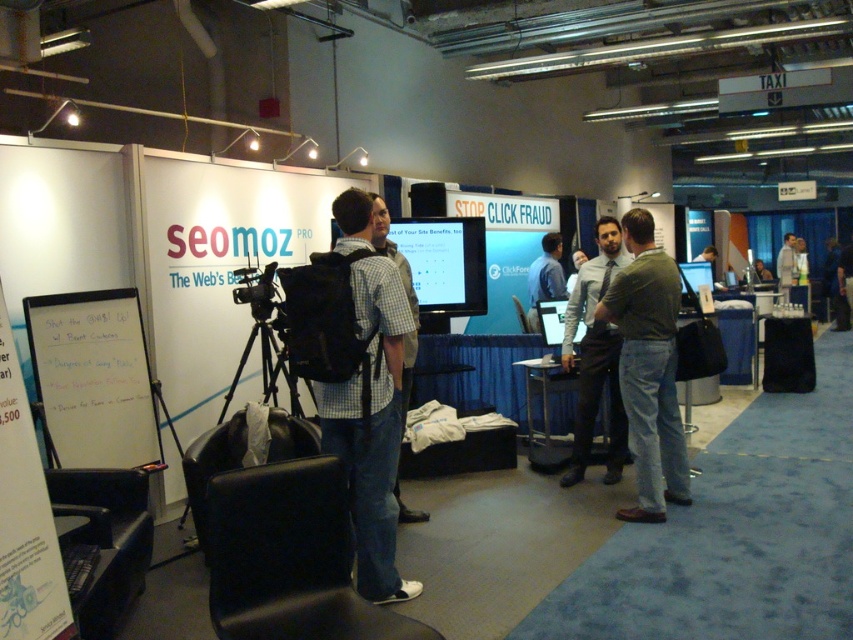
Question: Can you confirm if whiteboard at left is bigger than light brown leather jacket at center?

Choices:
 (A) yes
 (B) no

Answer: (B)

Question: Which object is closer to the camera taking this photo?

Choices:
 (A) whiteboard at left
 (B) black matte video camera at center

Answer: (A)

Question: Can you confirm if blue shirt at center is thinner than light brown leather jacket at center?

Choices:
 (A) yes
 (B) no

Answer: (A)

Question: Is whiteboard at left to the right of black matte tripod at center from the viewer's perspective?

Choices:
 (A) yes
 (B) no

Answer: (B)

Question: Among these objects, which one is nearest to the camera?

Choices:
 (A) green cotton shirt at center
 (B) black matte tripod at center

Answer: (B)

Question: Estimate the real-world distances between objects in this image. Which object is closer to the checkered fabric shirt at center?

Choices:
 (A) silver metallic laptop at center
 (B) black matte tripod at center
 (C) black matte video camera at center

Answer: (B)